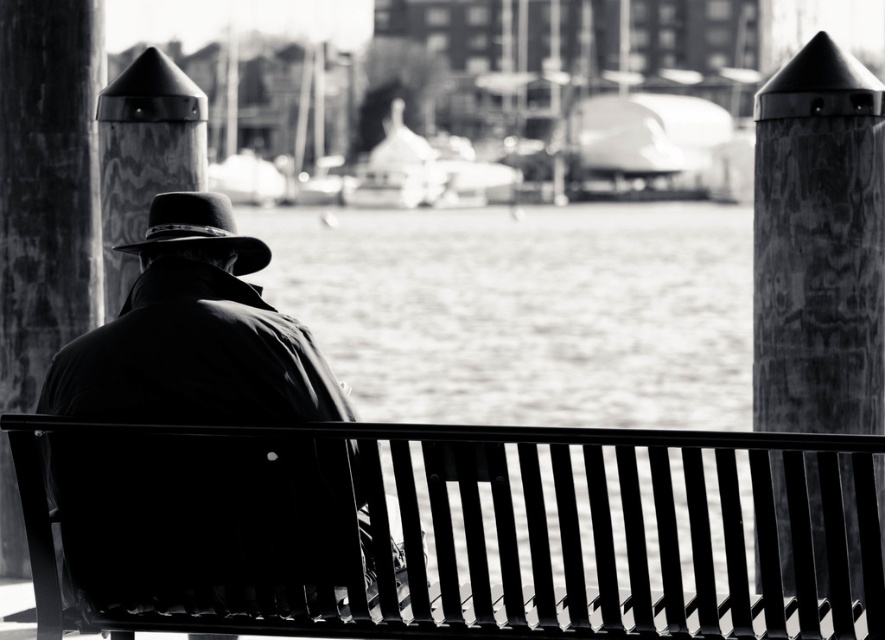
You are a photographer trying to capture the silhouette of the silhouette woolen coat at center and the smooth wood post at center left in the same frame. Based on their heights, which object will appear taller in the photo?

The smooth wood post at center left will appear taller in the photo because it is taller than the silhouette woolen coat at center.

You are an architect designing a new waterfront park and want to place a new bench between the wooden textured post at right and the smooth wood post at center left. Which post should the bench be closer to if you want it to be at the same height as the taller post?

The bench should be placed closer to the wooden textured post at right since it is taller than the smooth wood post at center left.

You are standing at the point labeled as point (818, 244) in the image. What is the closest object to you in the scene?

The closest object to you at point (818, 244) is the wooden textured post at right since the point is located on it.